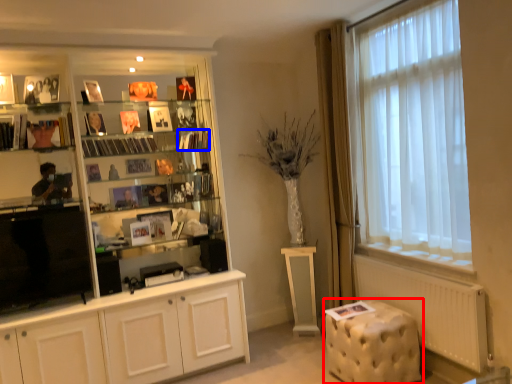
Question: Which point is further to the camera, music stool (highlighted by a red box) or book (highlighted by a blue box)?

Choices:
 (A) music stool
 (B) book

Answer: (B)